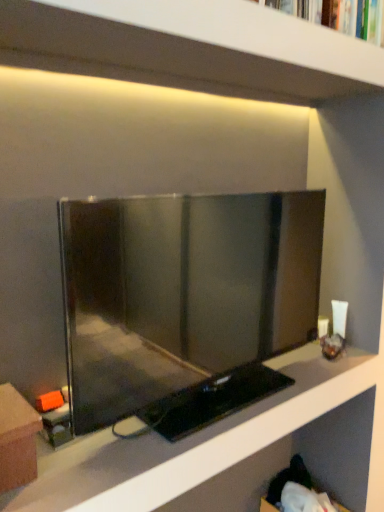
Question: Considering the relative positions of matte black tv at center and matte black tv at center, which is the 2th shelf in top-to-bottom order, in the image provided, is matte black tv at center to the left or to the right of matte black tv at center, which is the 2th shelf in top-to-bottom order,?

Choices:
 (A) left
 (B) right

Answer: (B)

Question: In the image, is matte black tv at center positioned in front of or behind matte black tv at center, which is the 2th shelf in top-to-bottom order?

Choices:
 (A) front
 (B) behind

Answer: (B)

Question: Which of these objects is positioned farthest from the hardcover book at upper center?

Choices:
 (A) matte black tv at center, arranged as the 1th shelf when ordered from the bottom
 (B) matte black tv at center
 (C) brown cardboard box at lower left
 (D) white matte shelf at upper center, which ranks as the 2th shelf in bottom-to-top order

Answer: (C)

Question: Which is nearer to the matte black tv at center?

Choices:
 (A) brown cardboard box at lower left
 (B) white matte shelf at upper center, which ranks as the 2th shelf in bottom-to-top order
 (C) hardcover book at upper center
 (D) matte black tv at center, arranged as the 1th shelf when ordered from the bottom

Answer: (D)